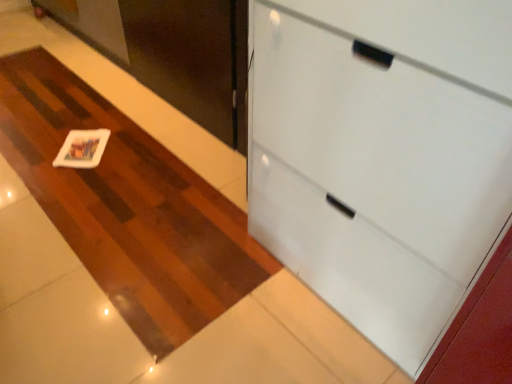
Locate an element on the screen. free space above white matte card at center (from a real-world perspective) is located at coordinates click(x=80, y=152).